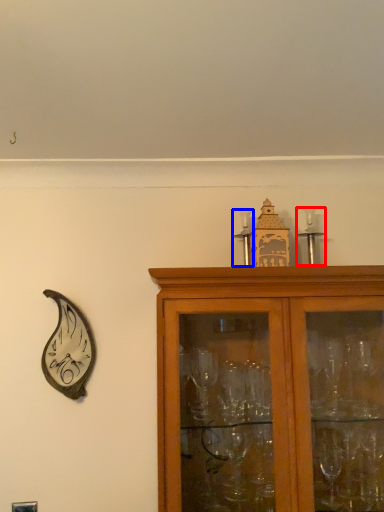
Question: Among these objects, which one is nearest to the camera, candle holder (highlighted by a red box) or candle holder (highlighted by a blue box)?

Choices:
 (A) candle holder
 (B) candle holder

Answer: (B)